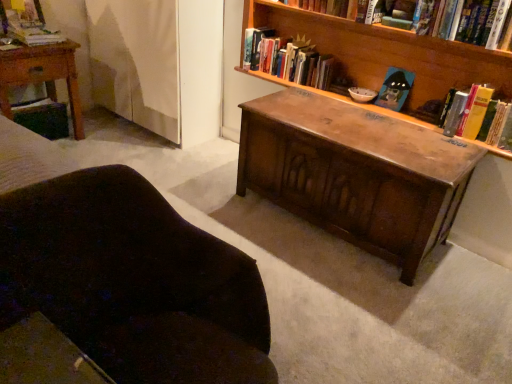
Question: In terms of height, does hardcover book at upper left, which ranks as the 1th book in left-to-right order, look taller or shorter compared to shiny brown wooden chest at center?

Choices:
 (A) tall
 (B) short

Answer: (B)

Question: Considering their positions, is hardcover book at upper left, which ranks as the 1th book in left-to-right order, located in front of or behind shiny brown wooden chest at center?

Choices:
 (A) behind
 (B) front

Answer: (A)

Question: Estimate the real-world distances between objects in this image. Which object is farther from the wooden bookshelf at upper center, positioned as the 5th book in right-to-left order?

Choices:
 (A) hardcover book at upper center, which ranks as the fourth book in right-to-left order
 (B) hardcover book at upper left, which ranks as the 1th book in left-to-right order
 (C) brown leather chair at lower left
 (D) yellow hardcover book at right, which is counted as the second book, starting from the right
 (E) yellow paperback book at right, the 6th book positioned from the left

Answer: (C)

Question: Which is nearer to the wooden nightstand at left?

Choices:
 (A) yellow hardcover book at right, which is counted as the second book, starting from the right
 (B) brown leather chair at lower left
 (C) hardcover book at upper left, the 6th book positioned from the right
 (D) wooden bookcase at center
 (E) yellow paperback book at right, the first book when ordered from right to left

Answer: (C)